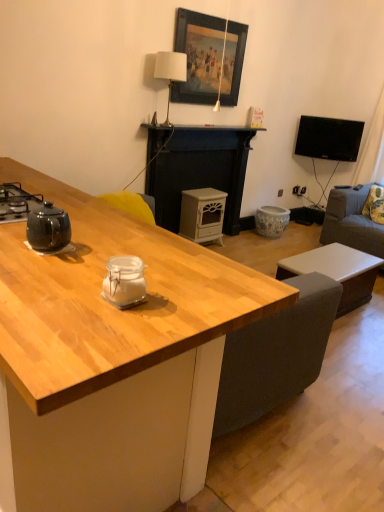
Question: In which direction should I rotate to look at clear glass jar at center, marked as the 2th appliance in a top-to-bottom arrangement?

Choices:
 (A) left
 (B) right

Answer: (A)

Question: Is white matte fireplace at center located outside wooden desk at center?

Choices:
 (A) no
 (B) yes

Answer: (B)

Question: Is white matte fireplace at center far away from wooden desk at center?

Choices:
 (A) yes
 (B) no

Answer: (A)

Question: Is white matte fireplace at center facing away from wooden desk at center?

Choices:
 (A) yes
 (B) no

Answer: (B)

Question: Considering the relative sizes of white matte fireplace at center and wooden desk at center in the image provided, is white matte fireplace at center smaller than wooden desk at center?

Choices:
 (A) no
 (B) yes

Answer: (B)

Question: Could you tell me if white matte fireplace at center is facing wooden desk at center?

Choices:
 (A) yes
 (B) no

Answer: (B)

Question: From a real-world perspective, does white matte fireplace at center stand above wooden desk at center?

Choices:
 (A) yes
 (B) no

Answer: (A)

Question: Is clear glass jar at center, which appears as the first appliance when ordered from the bottom, located outside white matte wood stove at center, which appears as the 1th appliance when viewed from the back?

Choices:
 (A) no
 (B) yes

Answer: (B)

Question: Can you confirm if clear glass jar at center, marked as the 2th appliance in a top-to-bottom arrangement, is bigger than white matte wood stove at center, which is counted as the 2th appliance, starting from the left?

Choices:
 (A) no
 (B) yes

Answer: (A)

Question: Is the depth of clear glass jar at center, the 1th appliance when ordered from front to back, greater than that of white matte wood stove at center, which appears as the 2th appliance when ordered from the bottom?

Choices:
 (A) yes
 (B) no

Answer: (B)

Question: Does clear glass jar at center, marked as the 2th appliance in a top-to-bottom arrangement, have a lesser height compared to white matte wood stove at center, arranged as the first appliance when viewed from the top?

Choices:
 (A) no
 (B) yes

Answer: (B)

Question: Is clear glass jar at center, positioned as the second appliance in back-to-front order, next to white matte wood stove at center, which is the second appliance in front-to-back order?

Choices:
 (A) yes
 (B) no

Answer: (B)

Question: Is there a large distance between clear glass jar at center, the 1th appliance when ordered from front to back, and white matte wood stove at center, which appears as the 1th appliance when viewed from the back?

Choices:
 (A) no
 (B) yes

Answer: (B)

Question: Is black glossy tv at upper right shorter than white matte fireplace at center?

Choices:
 (A) no
 (B) yes

Answer: (B)